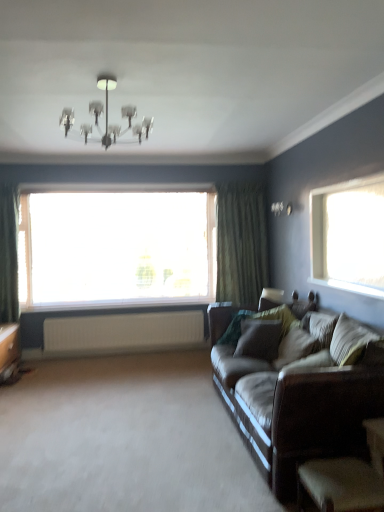
Measure the distance between dark brown leather armchair at lower right and camera.

dark brown leather armchair at lower right and camera are 5.89 feet apart.

At what (x,y) coordinates should I click in order to perform the action: click on green textured curtain at right. Please return your answer as a coordinate pair (x, y). Looking at the image, I should click on (241, 243).

The height and width of the screenshot is (512, 384). What do you see at coordinates (118, 307) in the screenshot?
I see `white plastic window sill at center` at bounding box center [118, 307].

What do you see at coordinates (295, 347) in the screenshot?
I see `light brown fabric pillow at right` at bounding box center [295, 347].

Locate an element on the screen. The width and height of the screenshot is (384, 512). metallic chandelier at upper center is located at coordinates [x=121, y=115].

In the scene shown: In order to face metallic chandelier at upper center, should I rotate leftwards or rightwards?

Turn left by 11.026 degrees to look at metallic chandelier at upper center.

Image resolution: width=384 pixels, height=512 pixels. I want to click on dark brown leather armchair at lower right, so click(x=347, y=478).

Is white ribbed radiator at lower center not inside green textured curtain at right?

Yes, white ribbed radiator at lower center is located beyond the bounds of green textured curtain at right.

From the image's perspective, is white ribbed radiator at lower center positioned above or below green textured curtain at right?

white ribbed radiator at lower center is situated lower than green textured curtain at right in the image.

Considering the relative sizes of white ribbed radiator at lower center and green textured curtain at right in the image provided, is white ribbed radiator at lower center bigger than green textured curtain at right?

Incorrect, white ribbed radiator at lower center is not larger than green textured curtain at right.

Would you say white ribbed radiator at lower center is a long distance from green textured curtain at right?

white ribbed radiator at lower center is positioned a significant distance from green textured curtain at right.

Looking at their sizes, would you say brown leather couch at right is wider or thinner than transparent glass window at center?

brown leather couch at right is wider than transparent glass window at center.

Is brown leather couch at right to the right of transparent glass window at center from the viewer's perspective?

Yes.

Is brown leather couch at right closer to the viewer compared to transparent glass window at center?

Yes, it is.

Is point (379, 362) positioned behind point (168, 216)?

No.

Is there a large distance between brown leather couch at lower right and white ribbed radiator at lower center?

Yes.

From a real-world perspective, which is physically above, brown leather couch at lower right or white ribbed radiator at lower center?

white ribbed radiator at lower center is physically above.

Is brown leather couch at lower right oriented away from white ribbed radiator at lower center?

No, brown leather couch at lower right is not facing away from white ribbed radiator at lower center.

Is point (204, 473) closer or farther from the camera than point (139, 345)?

Point (204, 473) is positioned closer to the camera compared to point (139, 345).

Is white plastic window sill at center aimed at dark brown leather armchair at lower right?

Result: No, white plastic window sill at center is not aimed at dark brown leather armchair at lower right.

Would you consider white plastic window sill at center to be distant from dark brown leather armchair at lower right?

Yes, white plastic window sill at center is far from dark brown leather armchair at lower right.

Is white plastic window sill at center situated inside dark brown leather armchair at lower right or outside?

white plastic window sill at center is not inside dark brown leather armchair at lower right, it's outside.

Considering the sizes of objects light brown fabric pillow at right and white ribbed radiator at lower center in the image provided, who is shorter, light brown fabric pillow at right or white ribbed radiator at lower center?

light brown fabric pillow at right.

From the image's perspective, is light brown fabric pillow at right positioned above or below white ribbed radiator at lower center?

light brown fabric pillow at right is above white ribbed radiator at lower center.

From a real-world perspective, relative to white ribbed radiator at lower center, is light brown fabric pillow at right vertically above or below?

Clearly, from a real-world perspective, light brown fabric pillow at right is above white ribbed radiator at lower center.

Is light brown fabric pillow at right not inside white ribbed radiator at lower center?

light brown fabric pillow at right is positioned outside white ribbed radiator at lower center.

Would you say white plastic window sill at center is to the left or to the right of brown leather couch at lower right in the picture?

From the image, it's evident that white plastic window sill at center is to the left of brown leather couch at lower right.

Between point (204, 298) and point (155, 390), which one is positioned behind?

Positioned behind is point (204, 298).

From a real-world perspective, is white plastic window sill at center under brown leather couch at lower right?

No, from a real-world perspective, white plastic window sill at center is not beneath brown leather couch at lower right.

From the image's perspective, which is below, brown leather couch at right or metallic chandelier at upper center?

brown leather couch at right, from the image's perspective.

Considering the points (318, 361) and (144, 129), which point is behind, point (318, 361) or point (144, 129)?

The point (318, 361) is behind.

Is brown leather couch at right at the right side of metallic chandelier at upper center?

Yes, brown leather couch at right is to the right of metallic chandelier at upper center.

Considering the relative sizes of brown leather couch at right and metallic chandelier at upper center in the image provided, is brown leather couch at right taller than metallic chandelier at upper center?

Indeed, brown leather couch at right has a greater height compared to metallic chandelier at upper center.

What are the coordinates of `radiator lying below the green textured curtain at right (from the image's perspective)` in the screenshot? It's located at (123, 333).

In the image, there is a brown leather couch at right. Where is `window above it (from the image's perspective)`? window above it (from the image's perspective) is located at coordinates (116, 247).

Based on their spatial positions, is metallic chandelier at upper center or white ribbed radiator at lower center closer to brown leather couch at right?

metallic chandelier at upper center lies closer to brown leather couch at right than the other object.

Based on their spatial positions, is white ribbed radiator at lower center or brown leather couch at right closer to dark brown leather armchair at lower right?

Among the two, brown leather couch at right is located nearer to dark brown leather armchair at lower right.

Based on their spatial positions, is white plastic window sill at center or light brown fabric pillow at right closer to transparent glass window at center?

Based on the image, white plastic window sill at center appears to be nearer to transparent glass window at center.

Based on their spatial positions, is metallic chandelier at upper center or dark brown leather armchair at lower right further from light brown fabric pillow at right?

Among the two, metallic chandelier at upper center is located further to light brown fabric pillow at right.

Estimate the real-world distances between objects in this image. Which object is closer to white ribbed radiator at lower center, green textured curtain at right or metallic chandelier at upper center?

green textured curtain at right lies closer to white ribbed radiator at lower center than the other object.

From the image, which object appears to be farther from metallic chandelier at upper center, brown leather couch at lower right or brown leather couch at right?

brown leather couch at lower right is positioned further to the anchor metallic chandelier at upper center.

When comparing their distances from light brown fabric pillow at right, does green textured curtain at right or brown leather couch at lower right seem closer?

brown leather couch at lower right is positioned closer to the anchor light brown fabric pillow at right.

Looking at the image, which one is located further to dark brown leather armchair at lower right, green textured curtain at right or white plastic window sill at center?

white plastic window sill at center is further to dark brown leather armchair at lower right.

Identify the location of pillow between dark brown leather armchair at lower right and white ribbed radiator at lower center in the front-back direction. This screenshot has height=512, width=384. (295, 347).

This screenshot has height=512, width=384. I want to click on radiator between white plastic window sill at center and green textured curtain at right from left to right, so click(123, 333).

Where is `radiator between dark brown leather armchair at lower right and green textured curtain at right in the front-back direction`? radiator between dark brown leather armchair at lower right and green textured curtain at right in the front-back direction is located at coordinates point(123,333).

I want to click on radiator between brown leather couch at lower right and green textured curtain at right along the z-axis, so click(123, 333).